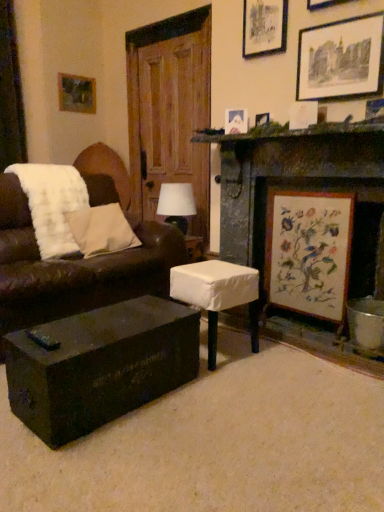
Question: From a real-world perspective, is matte paper picture frame at upper right, which is counted as the sixth picture frame, starting from the left, located beneath white fluffy pillow at left?

Choices:
 (A) no
 (B) yes

Answer: (A)

Question: From the image's perspective, is matte paper picture frame at upper right, which is counted as the 3th picture frame, starting from the top, on white fluffy pillow at left?

Choices:
 (A) yes
 (B) no

Answer: (A)

Question: From the image's perspective, is matte paper picture frame at upper right, which ranks as the first picture frame in right-to-left order, below white fluffy pillow at left?

Choices:
 (A) no
 (B) yes

Answer: (A)

Question: Is matte paper picture frame at upper right, the 4th picture frame from the bottom, wider than white fluffy pillow at left?

Choices:
 (A) no
 (B) yes

Answer: (A)

Question: Is matte paper picture frame at upper right, positioned as the first picture frame in front-to-back order, not within white fluffy pillow at left?

Choices:
 (A) yes
 (B) no

Answer: (A)

Question: Is matte paper picture frame at upper right, which ranks as the first picture frame in right-to-left order, to the left of white fluffy pillow at left from the viewer's perspective?

Choices:
 (A) no
 (B) yes

Answer: (A)

Question: From a real-world perspective, does brown leather couch at left stand above wooden fireplace at right?

Choices:
 (A) yes
 (B) no

Answer: (B)

Question: Does brown leather couch at left have a greater width compared to wooden fireplace at right?

Choices:
 (A) no
 (B) yes

Answer: (B)

Question: Does brown leather couch at left have a larger size compared to wooden fireplace at right?

Choices:
 (A) no
 (B) yes

Answer: (B)

Question: From a real-world perspective, is brown leather couch at left below wooden fireplace at right?

Choices:
 (A) no
 (B) yes

Answer: (B)

Question: Does brown leather couch at left have a greater height compared to wooden fireplace at right?

Choices:
 (A) yes
 (B) no

Answer: (B)

Question: Considering the relative positions of brown leather couch at left and wooden fireplace at right in the image provided, is brown leather couch at left in front of wooden fireplace at right?

Choices:
 (A) no
 (B) yes

Answer: (A)

Question: Is matte black trunk at lower center with matte white picture frame at upper right, which ranks as the 4th picture frame in back-to-front order?

Choices:
 (A) yes
 (B) no

Answer: (B)